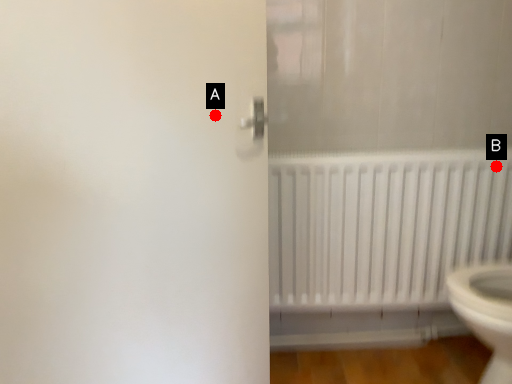
Question: Two points are circled on the image, labeled by A and B beside each circle. Which of the following is the closest to the observer?

Choices:
 (A) A is closer
 (B) B is closer

Answer: (A)